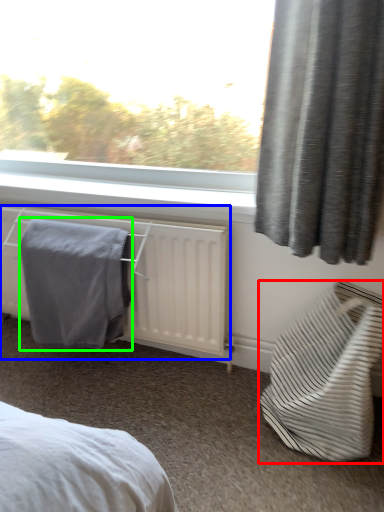
Question: Considering the real-world distances, which object is closest to furniture (highlighted by a red box)? radiator (highlighted by a blue box) or bath towel (highlighted by a green box).

Choices:
 (A) radiator
 (B) bath towel

Answer: (A)